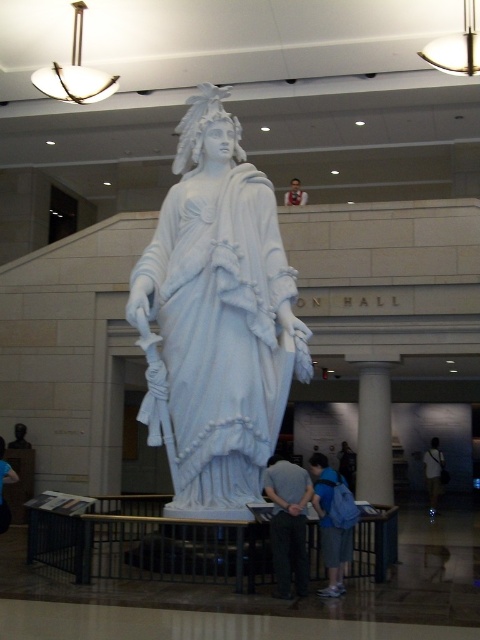
Can you confirm if blue denim jeans at lower left is smaller than light brown wooden frame at upper center?

No.

Does blue denim jeans at lower left appear on the left side of light brown wooden frame at upper center?

Indeed, blue denim jeans at lower left is positioned on the left side of light brown wooden frame at upper center.

Is point (4, 508) behind point (304, 192)?

No, it is not.

Image resolution: width=480 pixels, height=640 pixels. In order to click on blue denim jeans at lower left in this screenshot , I will do `click(2, 484)`.

Does dark blue backpack at lower right have a lesser height compared to blue denim jeans at lower left?

No.

Between point (430, 486) and point (13, 472), which one is positioned behind?

The point (430, 486) is behind.

What are the coordinates of `dark blue backpack at lower right` in the screenshot? It's located at (433, 472).

Where is `dark blue backpack at lower right`? The height and width of the screenshot is (640, 480). dark blue backpack at lower right is located at coordinates (433, 472).

Based on the photo, which is more to the right, white marble pillar at center or dark blue backpack at lower right?

dark blue backpack at lower right

Which is above, white marble pillar at center or dark blue backpack at lower right?

Positioned higher is white marble pillar at center.

Does point (379, 410) come closer to viewer compared to point (431, 442)?

Yes.

Identify the location of white marble pillar at center. The width and height of the screenshot is (480, 640). (373, 435).